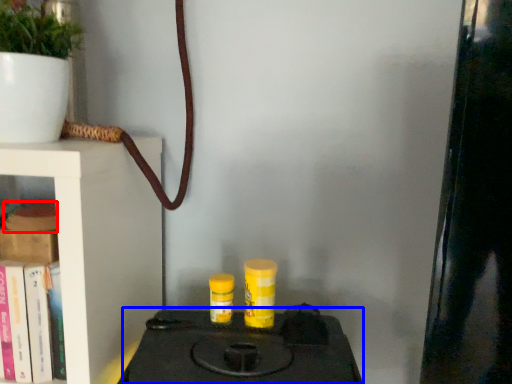
Question: Which of the following is the closest to the observer, book (highlighted by a red box) or stove (highlighted by a blue box)?

Choices:
 (A) book
 (B) stove

Answer: (B)